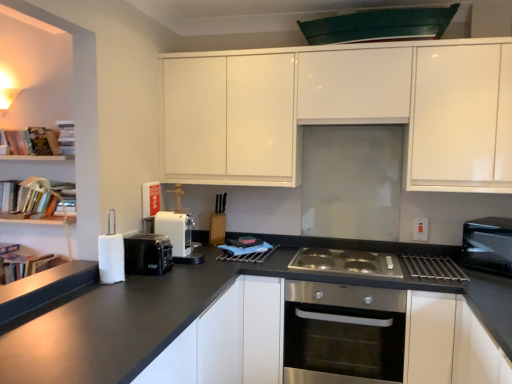
Identify the location of glossy white cabinets at upper center, the 1th cabinetry positioned from the top. (341, 110).

The width and height of the screenshot is (512, 384). What do you see at coordinates (38, 197) in the screenshot? I see `hardcover book at left, positioned as the 3th book in right-to-left order` at bounding box center [38, 197].

Locate an element on the screen. The width and height of the screenshot is (512, 384). hardcover book at left, positioned as the 3th book in right-to-left order is located at coordinates (38, 197).

Image resolution: width=512 pixels, height=384 pixels. Describe the element at coordinates (347, 262) in the screenshot. I see `silver metallic gas stove at center` at that location.

Locate an element on the screen. The height and width of the screenshot is (384, 512). black plastic microwave at right is located at coordinates (488, 245).

Locate an element on the screen. The height and width of the screenshot is (384, 512). green matte exhaust hood at upper center is located at coordinates click(x=380, y=25).

How distant is hardcover book at left, which ranks as the 2th book in right-to-left order, from hardcover books at upper left, the 4th book from the left?

They are 15.40 centimeters apart.

Consider the image. Considering the sizes of objects hardcover book at left, which ranks as the third book in left-to-right order, and hardcover books at upper left, which ranks as the 1th book in right-to-left order, in the image provided, who is bigger, hardcover book at left, which ranks as the third book in left-to-right order, or hardcover books at upper left, which ranks as the 1th book in right-to-left order,?

With larger size is hardcover book at left, which ranks as the third book in left-to-right order.

Is hardcover book at left, which ranks as the third book in left-to-right order, shorter than hardcover books at upper left, the 4th book from the left?

Yes, hardcover book at left, which ranks as the third book in left-to-right order, is shorter than hardcover books at upper left, the 4th book from the left.

Can hardcover books at upper left, which ranks as the 1th book in right-to-left order, be found inside hardcover book at left, which ranks as the 2th book in right-to-left order?

No, hardcover book at left, which ranks as the 2th book in right-to-left order, does not contain hardcover books at upper left, which ranks as the 1th book in right-to-left order.

Based on their positions, is hardcover book at left, which ranks as the 2th book in right-to-left order, located to the left or right of hardcover book at left, positioned as the 3th book in right-to-left order?

In the image, hardcover book at left, which ranks as the 2th book in right-to-left order, appears on the right side of hardcover book at left, positioned as the 3th book in right-to-left order.

I want to click on the 2nd book below the hardcover book at left, which ranks as the third book in left-to-right order (from the image's perspective), so click(x=38, y=197).

Who is taller, hardcover book at left, which ranks as the 2th book in right-to-left order, or hardcover book at left, positioned as the second book in left-to-right order?

hardcover book at left, positioned as the second book in left-to-right order, is taller.

Considering the points (185, 112) and (12, 153), which point is in front, point (185, 112) or point (12, 153)?

The point (185, 112) is closer to the camera.

Is glossy white cabinets at upper center, the 1th cabinetry positioned from the top, in front of or behind hardcover book at left, which ranks as the third book in left-to-right order, in the image?

Clearly, glossy white cabinets at upper center, the 1th cabinetry positioned from the top, is in front of hardcover book at left, which ranks as the third book in left-to-right order.

Which is more to the left, glossy white cabinets at upper center, the 1th cabinetry positioned from the top, or hardcover book at left, which ranks as the third book in left-to-right order?

Positioned to the left is hardcover book at left, which ranks as the third book in left-to-right order.

In terms of width, does glossy white cabinets at upper center, the 2th cabinetry ordered from the bottom, look wider or thinner when compared to hardcover book at left, which ranks as the third book in left-to-right order?

In the image, glossy white cabinets at upper center, the 2th cabinetry ordered from the bottom, appears to be wider than hardcover book at left, which ranks as the third book in left-to-right order.

Consider the image. Which object is thinner, white matte cabinet at center, the second cabinetry when ordered from top to bottom, or green matte exhaust hood at upper center?

Thinner between the two is green matte exhaust hood at upper center.

Is green matte exhaust hood at upper center inside white matte cabinet at center, the second cabinetry when ordered from top to bottom?

No, green matte exhaust hood at upper center is located outside of white matte cabinet at center, the second cabinetry when ordered from top to bottom.

Is white matte cabinet at center, marked as the first cabinetry in a bottom-to-top arrangement, closer to the viewer compared to green matte exhaust hood at upper center?

No, it is not.

Considering the sizes of objects white matte cabinet at center, marked as the first cabinetry in a bottom-to-top arrangement, and green matte exhaust hood at upper center in the image provided, who is shorter, white matte cabinet at center, marked as the first cabinetry in a bottom-to-top arrangement, or green matte exhaust hood at upper center?

Standing shorter between the two is green matte exhaust hood at upper center.

Is hardcover book at left, the first book from the left, turned away from hardcover books at upper left, the 4th book from the left?

No, hardcover book at left, the first book from the left, is not facing the opposite direction of hardcover books at upper left, the 4th book from the left.

Considering the positions of objects hardcover book at left, the first book from the left, and hardcover books at upper left, the 4th book from the left, in the image provided, who is more to the right, hardcover book at left, the first book from the left, or hardcover books at upper left, the 4th book from the left,?

From the viewer's perspective, hardcover books at upper left, the 4th book from the left, appears more on the right side.

Looking at their sizes, would you say hardcover book at left, the first book from the left, is wider or thinner than hardcover books at upper left, the 4th book from the left?

Clearly, hardcover book at left, the first book from the left, has more width compared to hardcover books at upper left, the 4th book from the left.

From the image's perspective, which one is positioned lower, hardcover book at left, the first book from the left, or hardcover books at upper left, the 4th book from the left?

hardcover book at left, the first book from the left.

Is the surface of white matte cabinet at center, marked as the first cabinetry in a bottom-to-top arrangement, in direct contact with silver metallic gas stove at center?

No, white matte cabinet at center, marked as the first cabinetry in a bottom-to-top arrangement, is not with silver metallic gas stove at center.

Which is more to the right, white matte cabinet at center, the second cabinetry when ordered from top to bottom, or silver metallic gas stove at center?

silver metallic gas stove at center.

From the image's perspective, relative to silver metallic gas stove at center, is white matte cabinet at center, the second cabinetry when ordered from top to bottom, above or below?

white matte cabinet at center, the second cabinetry when ordered from top to bottom, is below silver metallic gas stove at center.

Considering the points (270, 290) and (343, 269), which point is behind, point (270, 290) or point (343, 269)?

The point (343, 269) is farther.

Is glossy white cabinets at upper center, the 1th cabinetry positioned from the top, with silver metallic gas stove at center?

No, glossy white cabinets at upper center, the 1th cabinetry positioned from the top, is not beside silver metallic gas stove at center.

From a real-world perspective, is glossy white cabinets at upper center, the 1th cabinetry positioned from the top, physically located above or below silver metallic gas stove at center?

Clearly, from a real-world perspective, glossy white cabinets at upper center, the 1th cabinetry positioned from the top, is above silver metallic gas stove at center.

Considering the points (350, 83) and (388, 270), which point is in front, point (350, 83) or point (388, 270)?

Point (388, 270)

Is glossy white cabinets at upper center, the 2th cabinetry ordered from the bottom, positioned before silver metallic gas stove at center?

That is True.

Where is `book above the hardcover book at left, which ranks as the third book in left-to-right order (from the image's perspective)`? This screenshot has height=384, width=512. book above the hardcover book at left, which ranks as the third book in left-to-right order (from the image's perspective) is located at coordinates (66, 137).

From the hardcover book at left, which ranks as the third book in left-to-right order, count the 1st book to the left and point to it. Please provide its 2D coordinates.

[(38, 197)]

Estimate the real-world distances between objects in this image. Which object is further from hardcover books at upper left, which ranks as the 1th book in right-to-left order, black plastic toaster at lower left, the second appliance when ordered from back to front, or hardcover book at left, placed as the 4th book when sorted from right to left?

black plastic toaster at lower left, the second appliance when ordered from back to front, lies further to hardcover books at upper left, which ranks as the 1th book in right-to-left order, than the other object.

Based on the photo, from the image, which object appears to be nearer to glossy white cabinets at upper center, the 2th cabinetry ordered from the bottom, hardcover book at left, which ranks as the third book in left-to-right order, or white plastic electric outlet at right?

Based on the image, white plastic electric outlet at right appears to be nearer to glossy white cabinets at upper center, the 2th cabinetry ordered from the bottom.

When comparing their distances from white plastic coffee machine at center, positioned as the 1th appliance in back-to-front order, does hardcover books at upper left, the 4th book from the left, or white plastic electric outlet at right seem closer?

hardcover books at upper left, the 4th book from the left.

When comparing their distances from white matte cabinet at center, marked as the first cabinetry in a bottom-to-top arrangement, does glossy white cabinets at upper center, the 1th cabinetry positioned from the top, or hardcover books at upper left, the 4th book from the left, seem further?

Among the two, hardcover books at upper left, the 4th book from the left, is located further to white matte cabinet at center, marked as the first cabinetry in a bottom-to-top arrangement.

Looking at the image, which one is located closer to white plastic electric outlet at right, stainless steel oven at center or hardcover book at left, which ranks as the 2th book in right-to-left order?

The object closer to white plastic electric outlet at right is stainless steel oven at center.

When comparing their distances from stainless steel oven at center, does black plastic microwave at right or white plastic electric outlet at right seem further?

white plastic electric outlet at right is further to stainless steel oven at center.

When comparing their distances from hardcover books at upper left, which ranks as the 1th book in right-to-left order, does glossy white cabinets at upper center, the 2th cabinetry ordered from the bottom, or black plastic microwave at right seem closer?

glossy white cabinets at upper center, the 2th cabinetry ordered from the bottom, is positioned closer to the anchor hardcover books at upper left, which ranks as the 1th book in right-to-left order.

Considering their positions, is black plastic microwave at right positioned closer to hardcover book at left, placed as the 4th book when sorted from right to left, than silver metallic gas stove at center?

silver metallic gas stove at center lies closer to hardcover book at left, placed as the 4th book when sorted from right to left, than the other object.

This screenshot has width=512, height=384. I want to click on book located between hardcover book at left, which ranks as the 2th book in right-to-left order, and black plastic toaster at lower left, the second appliance when ordered from back to front, in the left-right direction, so click(66, 137).

This screenshot has height=384, width=512. Identify the location of oven between hardcover book at left, the first book from the left, and silver metallic gas stove at center from left to right. (343, 333).

Find the location of a particular element. The image size is (512, 384). electric outlet that lies between green matte exhaust hood at upper center and silver metallic gas stove at center from top to bottom is located at coordinates (420, 229).

At what (x,y) coordinates should I click in order to perform the action: click on oven located between hardcover book at left, the first book from the left, and green matte exhaust hood at upper center in the left-right direction. Please return your answer as a coordinate pair (x, y). Looking at the image, I should click on (343, 333).